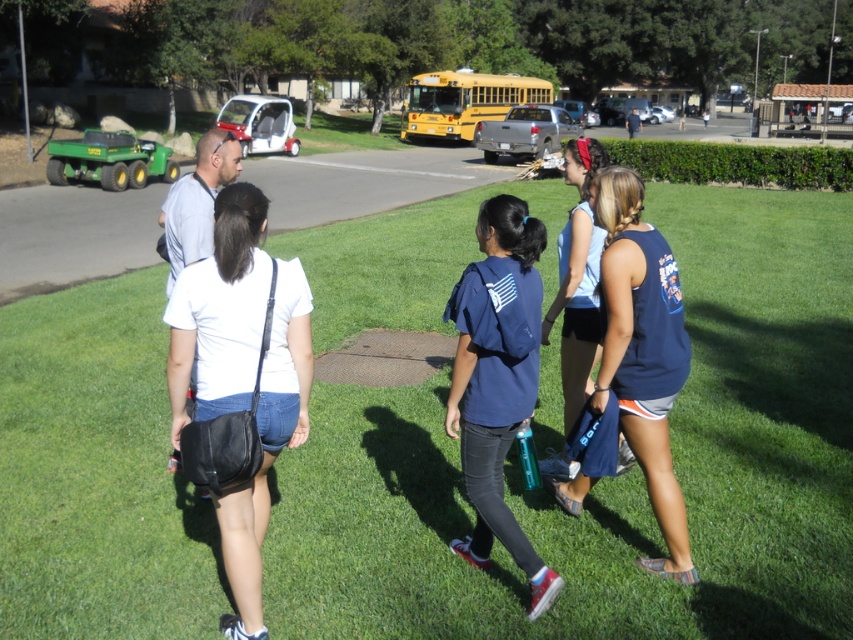
Question: Can you confirm if green grass at center is smaller than navy blue t-shirt at center?

Choices:
 (A) yes
 (B) no

Answer: (B)

Question: From the image, what is the correct spatial relationship of white matte shirt at center in relation to blue fabric tank top at center?

Choices:
 (A) below
 (B) above

Answer: (A)

Question: Which point is closer to the camera taking this photo?

Choices:
 (A) (428, 125)
 (B) (473, 612)
 (C) (578, 296)
 (D) (235, 340)

Answer: (D)

Question: Which of the following is the farthest from the observer?

Choices:
 (A) white matte shirt at center
 (B) green grass at center
 (C) yellow metallic bus at center
 (D) navy blue tank top at center-right

Answer: (C)

Question: Which is farther from the white matte shirt at center?

Choices:
 (A) navy blue tank top at center-right
 (B) blue fabric tank top at center

Answer: (B)

Question: Is navy blue tank top at center-right smaller than yellow metallic bus at center?

Choices:
 (A) yes
 (B) no

Answer: (A)